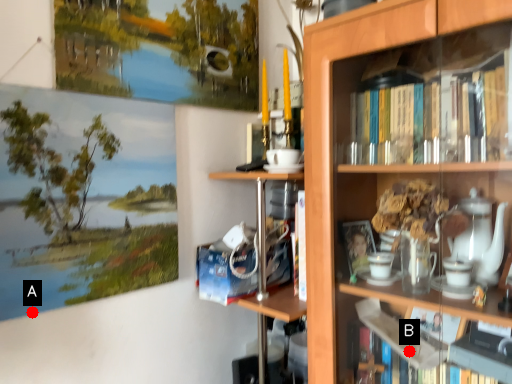
Question: Two points are circled on the image, labeled by A and B beside each circle. Which point is closer to the camera?

Choices:
 (A) A is closer
 (B) B is closer

Answer: (A)